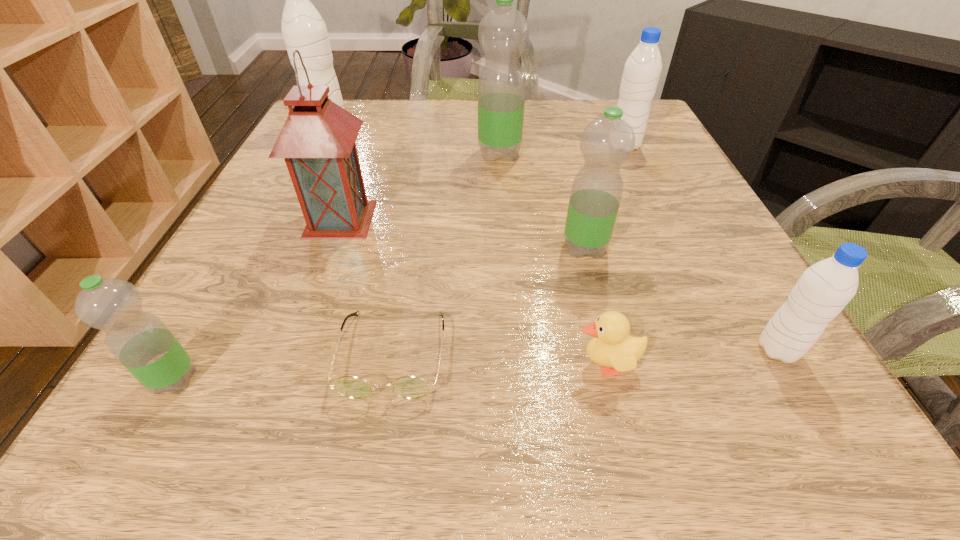
Image resolution: width=960 pixels, height=540 pixels. What are the coordinates of `the leftmost green water bottle` in the screenshot? It's located at (140, 341).

Where is `the nearest green water bottle`? The width and height of the screenshot is (960, 540). the nearest green water bottle is located at coordinates (140, 341).

This screenshot has width=960, height=540. I want to click on the rightmost water bottle, so click(824, 289).

Locate an element on the screen. This screenshot has width=960, height=540. the rightmost object is located at coordinates (824, 289).

Locate an element on the screen. the eighth tallest object is located at coordinates (613, 348).

You are a GUI agent. You are given a task and a screenshot of the screen. Output one action in this format:
    pyautogui.click(x=<x>, y=<y>)
    Task: Click on the yellow duckling
    This screenshot has height=540, width=960.
    Given the screenshot: What is the action you would take?
    pyautogui.click(x=613, y=348)

At what (x,y) coordinates should I click in order to perform the action: click on the sixth object from right to left. Please return your answer as a coordinate pair (x, y). Looking at the image, I should click on (408, 387).

The image size is (960, 540). I want to click on green spectacles, so click(x=408, y=387).

The image size is (960, 540). In order to click on free space located on the left of the farthest green water bottle in this screenshot , I will do `click(405, 154)`.

I want to click on vacant space located 0.130m on the front of the biggest gray water bottle, so click(x=308, y=165).